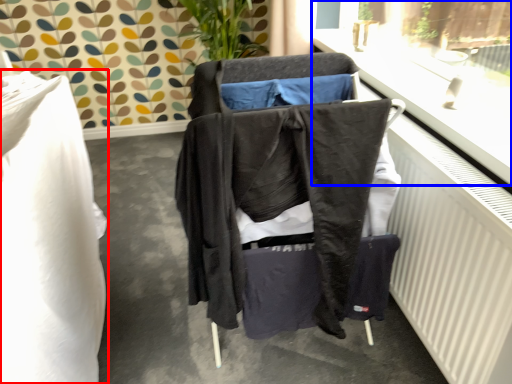
Question: Which object is further to the camera taking this photo, furniture (highlighted by a red box) or window frame (highlighted by a blue box)?

Choices:
 (A) furniture
 (B) window frame

Answer: (A)